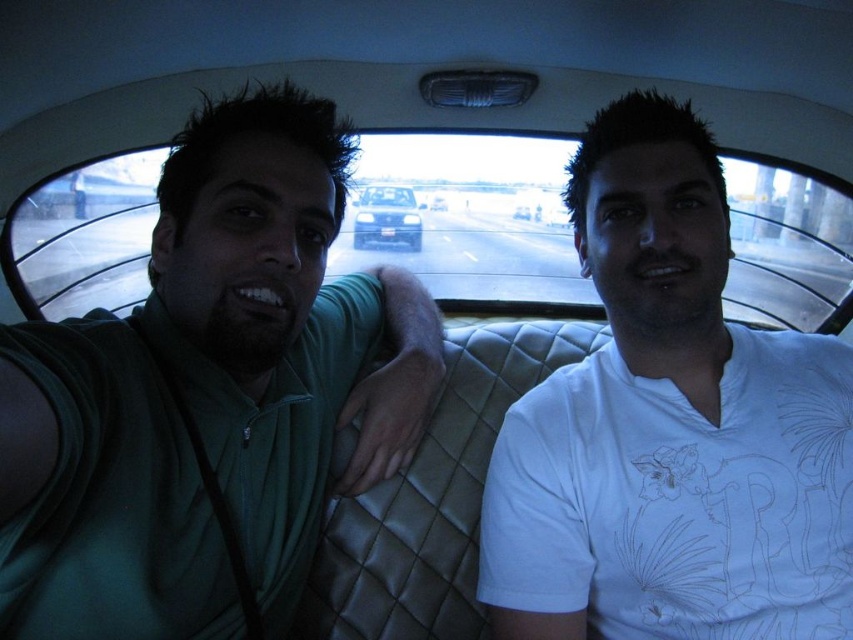
You are standing in front of the car seat and want to reach the point marked as point (589, 259). If your arm can extend 30 inches, can you reach it?

The point (589, 259) is 32.43 inches from the viewer. Since your arm can only extend 30 inches, you cannot reach it.

You are a photographer trying to capture a photo of the metallic silver sedan at center and the white matte shirt at right. If you want to ensure both objects are in focus, which one should you adjust your camera focus on first?

The white matte shirt at right has a lesser width compared to metallic silver sedan at center, so you should focus on the metallic silver sedan at center first because it is larger and will require more precise focus to capture details.